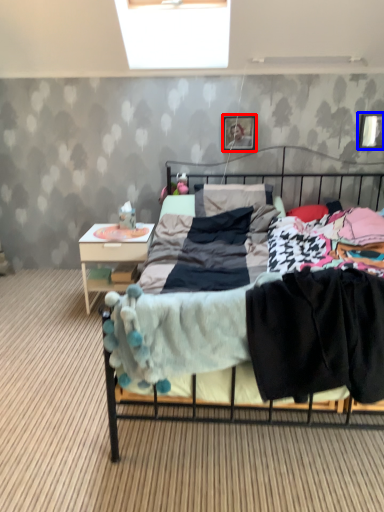
Question: Which object appears closest to the camera in this image, picture frame (highlighted by a red box) or picture frame (highlighted by a blue box)?

Choices:
 (A) picture frame
 (B) picture frame

Answer: (B)